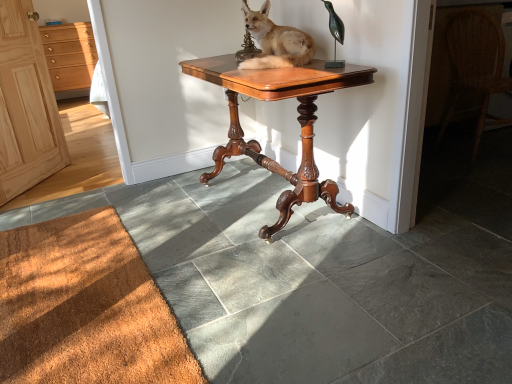
Question: Considering the relative positions of mahogany wood table at center and woven wicker chair at right in the image provided, is mahogany wood table at center to the right of woven wicker chair at right from the viewer's perspective?

Choices:
 (A) yes
 (B) no

Answer: (B)

Question: Are mahogany wood table at center and woven wicker chair at right far apart?

Choices:
 (A) no
 (B) yes

Answer: (B)

Question: Is mahogany wood table at center facing away from woven wicker chair at right?

Choices:
 (A) yes
 (B) no

Answer: (A)

Question: Is mahogany wood table at center next to woven wicker chair at right?

Choices:
 (A) no
 (B) yes

Answer: (A)

Question: Does mahogany wood table at center lie in front of woven wicker chair at right?

Choices:
 (A) no
 (B) yes

Answer: (B)

Question: From a real-world perspective, is mahogany wood table at center on top of woven wicker chair at right?

Choices:
 (A) yes
 (B) no

Answer: (B)

Question: Considering the relative sizes of light wood cabinet at left and mahogany wood table at center in the image provided, is light wood cabinet at left bigger than mahogany wood table at center?

Choices:
 (A) yes
 (B) no

Answer: (B)

Question: Is light wood cabinet at left closer to camera compared to mahogany wood table at center?

Choices:
 (A) no
 (B) yes

Answer: (A)

Question: Is the position of light wood cabinet at left more distant than that of mahogany wood table at center?

Choices:
 (A) no
 (B) yes

Answer: (B)

Question: Does light wood cabinet at left have a greater width compared to mahogany wood table at center?

Choices:
 (A) yes
 (B) no

Answer: (B)

Question: Does light wood cabinet at left appear on the left side of mahogany wood table at center?

Choices:
 (A) no
 (B) yes

Answer: (B)

Question: Could you tell me if light wood cabinet at left is turned towards mahogany wood table at center?

Choices:
 (A) yes
 (B) no

Answer: (A)

Question: Is light wood cabinet at left smaller than brown textured mat at lower left?

Choices:
 (A) yes
 (B) no

Answer: (B)